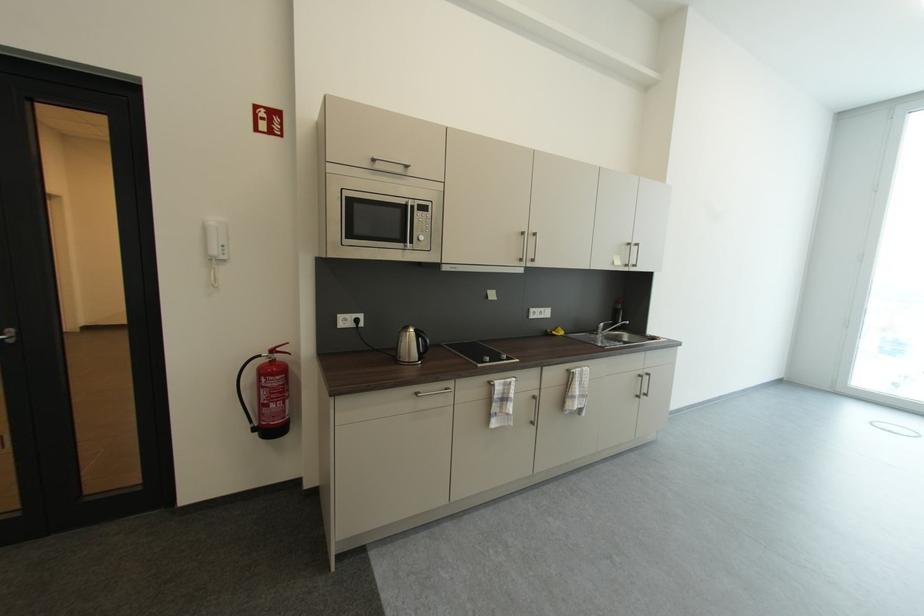
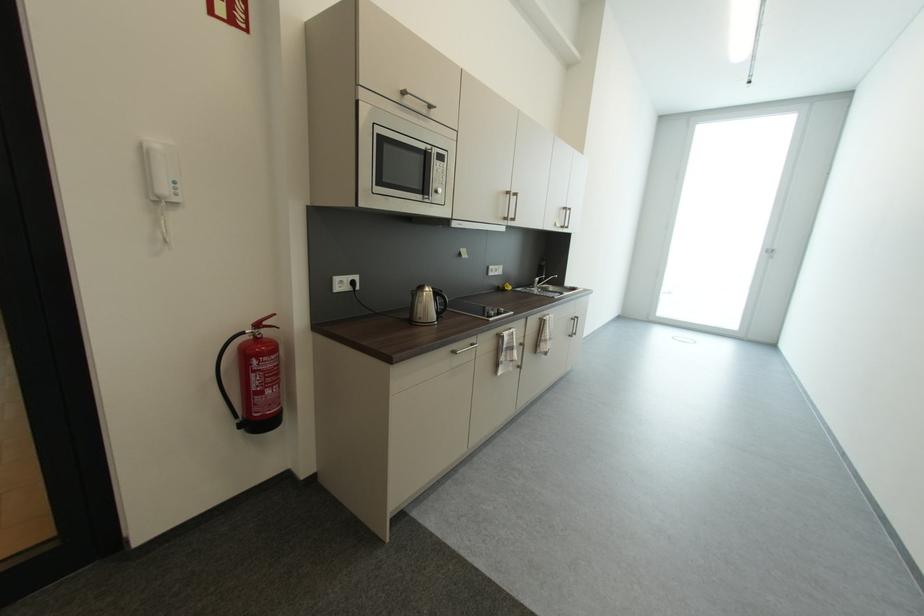
Question: The first image is from the beginning of the video and the second image is from the end. How did the camera likely rotate when shooting the video?

Choices:
 (A) Left
 (B) Right
 (C) Up
 (D) Down

Answer: (B)